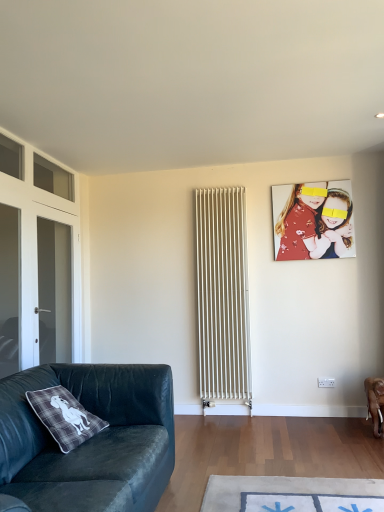
In order to click on velvet dark green couch at lower left in this screenshot , I will do `click(91, 439)`.

Locate an element on the screen. transparent glass door at left, which is counted as the second glass door, starting from the back is located at coordinates (9, 289).

Based on their sizes in the image, would you say matte red shirt at upper right is bigger or smaller than transparent glass door at left, which is counted as the second glass door, starting from the back?

Clearly, matte red shirt at upper right is larger in size than transparent glass door at left, which is counted as the second glass door, starting from the back.

From a real-world perspective, is matte red shirt at upper right beneath transparent glass door at left, which is counted as the second glass door, starting from the back?

Actually, matte red shirt at upper right is physically above transparent glass door at left, which is counted as the second glass door, starting from the back, in the real world.

Considering the relative positions of matte red shirt at upper right and transparent glass door at left, which is counted as the second glass door, starting from the back, in the image provided, is matte red shirt at upper right to the left of transparent glass door at left, which is counted as the second glass door, starting from the back, from the viewer's perspective?

No, matte red shirt at upper right is not to the left of transparent glass door at left, which is counted as the second glass door, starting from the back.

From the image's perspective, is transparent glass door at left, which is counted as the second glass door, starting from the back, on matte red shirt at upper right?

Actually, transparent glass door at left, which is counted as the second glass door, starting from the back, appears below matte red shirt at upper right in the image.

Is transparent glass door at left, which is counted as the first glass door, starting from the front, completely or partially outside of matte red shirt at upper right?

transparent glass door at left, which is counted as the first glass door, starting from the front, is positioned outside matte red shirt at upper right.

Does point (9, 298) appear closer or farther from the camera than point (307, 189)?

Point (9, 298) appears to be closer to the viewer than point (307, 189).

Are transparent glass door at left, which is counted as the first glass door, starting from the front, and matte red shirt at upper right located far from each other?

transparent glass door at left, which is counted as the first glass door, starting from the front, is far away from matte red shirt at upper right.

In the image, is transparent glass door at left, the second glass door positioned from the front, positioned in front of or behind white metal radiator at center?

Visually, transparent glass door at left, the second glass door positioned from the front, is located in front of white metal radiator at center.

Can we say transparent glass door at left, the second glass door positioned from the front, lies outside white metal radiator at center?

Yes, transparent glass door at left, the second glass door positioned from the front, is not within white metal radiator at center.

Based on the photo, which is more to the right, transparent glass door at left, the 1th glass door viewed from the back, or white metal radiator at center?

white metal radiator at center.

Consider the image. What's the angular difference between matte red shirt at upper right and white metal radiator at center's facing directions?

There is a 0.152-degree angle between the facing directions of matte red shirt at upper right and white metal radiator at center.

Considering their positions, is matte red shirt at upper right located in front of or behind white metal radiator at center?

Visually, matte red shirt at upper right is located behind white metal radiator at center.

From the image's perspective, which is above, matte red shirt at upper right or white metal radiator at center?

matte red shirt at upper right, from the image's perspective.

Considering the relative sizes of matte red shirt at upper right and white metal radiator at center in the image provided, is matte red shirt at upper right smaller than white metal radiator at center?

Correct, matte red shirt at upper right occupies less space than white metal radiator at center.

Image resolution: width=384 pixels, height=512 pixels. I want to click on person to the right of velvet dark green couch at lower left, so click(313, 220).

Is velvet dark green couch at lower left directly adjacent to matte red shirt at upper right?

velvet dark green couch at lower left is not next to matte red shirt at upper right, and they're not touching.

Is velvet dark green couch at lower left surrounding matte red shirt at upper right?

No, velvet dark green couch at lower left does not contain matte red shirt at upper right.

Is velvet dark green couch at lower left at the back of transparent glass door at left, which is counted as the first glass door, starting from the front?

transparent glass door at left, which is counted as the first glass door, starting from the front, is not turned away from velvet dark green couch at lower left.

Who is bigger, transparent glass door at left, which is counted as the first glass door, starting from the front, or velvet dark green couch at lower left?

With larger size is velvet dark green couch at lower left.

Which object is more forward, transparent glass door at left, which is counted as the second glass door, starting from the back, or velvet dark green couch at lower left?

velvet dark green couch at lower left.

Does matte red shirt at upper right have a larger size compared to transparent glass door at left, the 1th glass door viewed from the back?

Actually, matte red shirt at upper right might be smaller than transparent glass door at left, the 1th glass door viewed from the back.

Which is more to the right, matte red shirt at upper right or transparent glass door at left, the 1th glass door viewed from the back?

matte red shirt at upper right is more to the right.

Measure the distance from matte red shirt at upper right to transparent glass door at left, the second glass door positioned from the front.

They are 7.65 feet apart.

This screenshot has width=384, height=512. I want to click on person on the right side of transparent glass door at left, which is counted as the first glass door, starting from the front, so click(313, 220).

Find the location of `glass door that is the 2nd one when counting forward from the matte red shirt at upper right`. glass door that is the 2nd one when counting forward from the matte red shirt at upper right is located at coordinates (9, 289).

Which object lies further to the anchor point transparent glass door at left, which is counted as the second glass door, starting from the back, velvet dark green couch at lower left or matte red shirt at upper right?

matte red shirt at upper right is positioned further to the anchor transparent glass door at left, which is counted as the second glass door, starting from the back.

When comparing their distances from transparent glass door at left, which is counted as the first glass door, starting from the front, does transparent glass door at left, the second glass door positioned from the front, or matte red shirt at upper right seem closer?

transparent glass door at left, the second glass door positioned from the front, lies closer to transparent glass door at left, which is counted as the first glass door, starting from the front, than the other object.

Which object lies further to the anchor point velvet dark green couch at lower left, transparent glass door at left, which is counted as the second glass door, starting from the back, or white metal radiator at center?

white metal radiator at center lies further to velvet dark green couch at lower left than the other object.

Based on their spatial positions, is velvet dark green couch at lower left or transparent glass door at left, the second glass door positioned from the front, further from white metal radiator at center?

velvet dark green couch at lower left.

Looking at the image, which one is located closer to transparent glass door at left, which is counted as the first glass door, starting from the front, transparent glass door at left, the 1th glass door viewed from the back, or velvet dark green couch at lower left?

transparent glass door at left, the 1th glass door viewed from the back, lies closer to transparent glass door at left, which is counted as the first glass door, starting from the front, than the other object.

Based on their spatial positions, is velvet dark green couch at lower left or transparent glass door at left, which is counted as the second glass door, starting from the back, further from transparent glass door at left, the 1th glass door viewed from the back?

velvet dark green couch at lower left.

From the image, which object appears to be nearer to matte red shirt at upper right, transparent glass door at left, which is counted as the second glass door, starting from the back, or transparent glass door at left, the second glass door positioned from the front?

Among the two, transparent glass door at left, the second glass door positioned from the front, is located nearer to matte red shirt at upper right.

When comparing their distances from transparent glass door at left, which is counted as the second glass door, starting from the back, does white metal radiator at center or transparent glass door at left, the 1th glass door viewed from the back, seem closer?

transparent glass door at left, the 1th glass door viewed from the back.

Identify the location of glass door between transparent glass door at left, which is counted as the first glass door, starting from the front, and matte red shirt at upper right, in the horizontal direction. (53, 293).

You are a GUI agent. You are given a task and a screenshot of the screen. Output one action in this format:
    pyautogui.click(x=<x>, y=<y>)
    Task: Click on the glass door between transparent glass door at left, which is counted as the first glass door, starting from the front, and white metal radiator at center from left to right
    The image size is (384, 512).
    Given the screenshot: What is the action you would take?
    pyautogui.click(x=53, y=293)

I want to click on radiator between velvet dark green couch at lower left and matte red shirt at upper right along the z-axis, so click(x=222, y=297).

Find the location of a particular element. This screenshot has width=384, height=512. radiator between transparent glass door at left, which is counted as the second glass door, starting from the back, and matte red shirt at upper right is located at coordinates (222, 297).